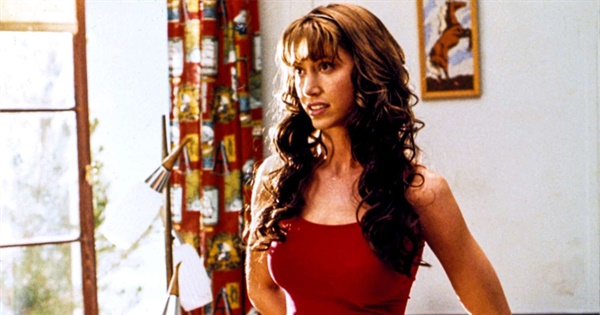
The image size is (600, 315). Identify the location of picture of a horse on back wall. (451, 16).